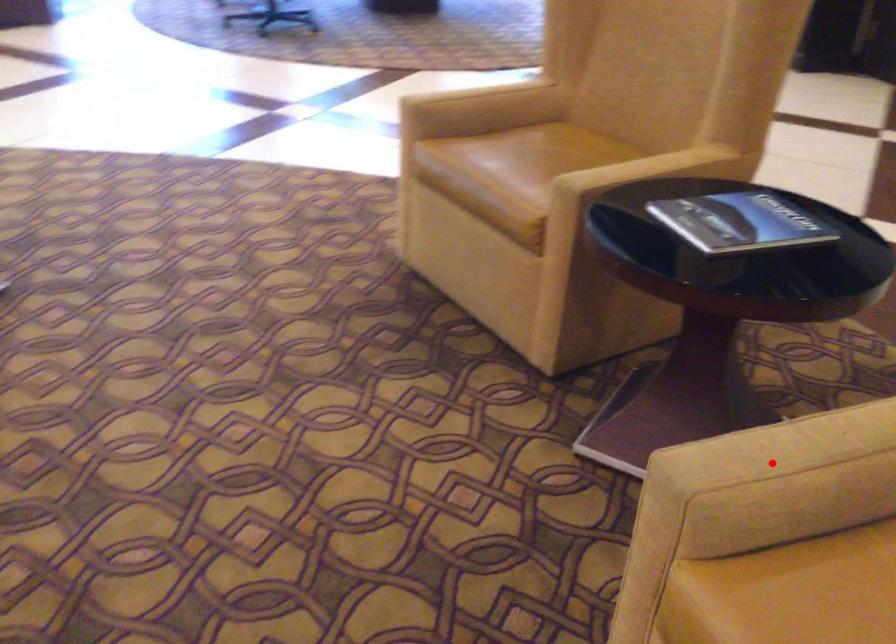
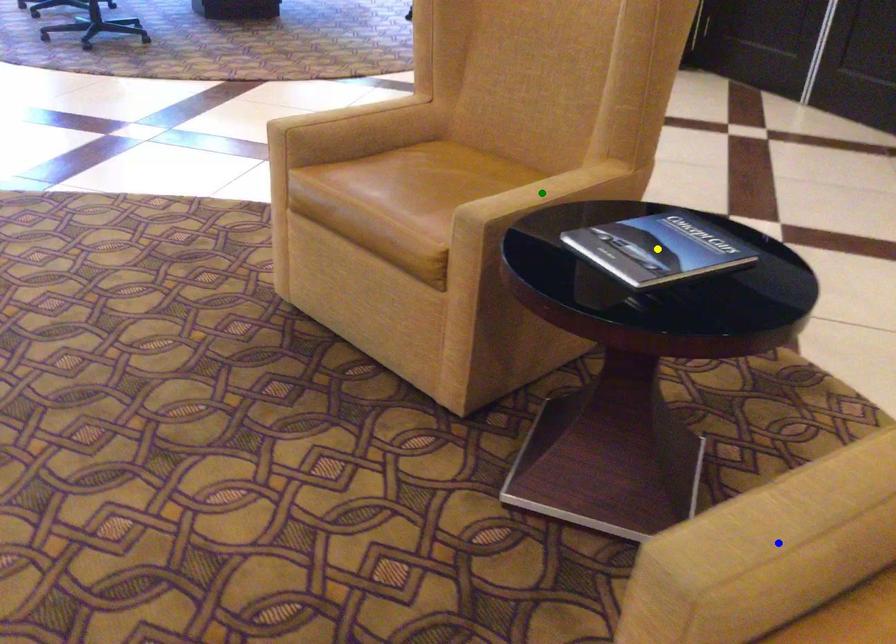
Question: I am providing you with two images of the same scene from different viewpoints. A red point is marked on the first image. You are given multiple points on the second image. Which point in image 2 represents the same 3d spot as the red point in image 1?

Choices:
 (A) green point
 (B) yellow point
 (C) blue point

Answer: (C)